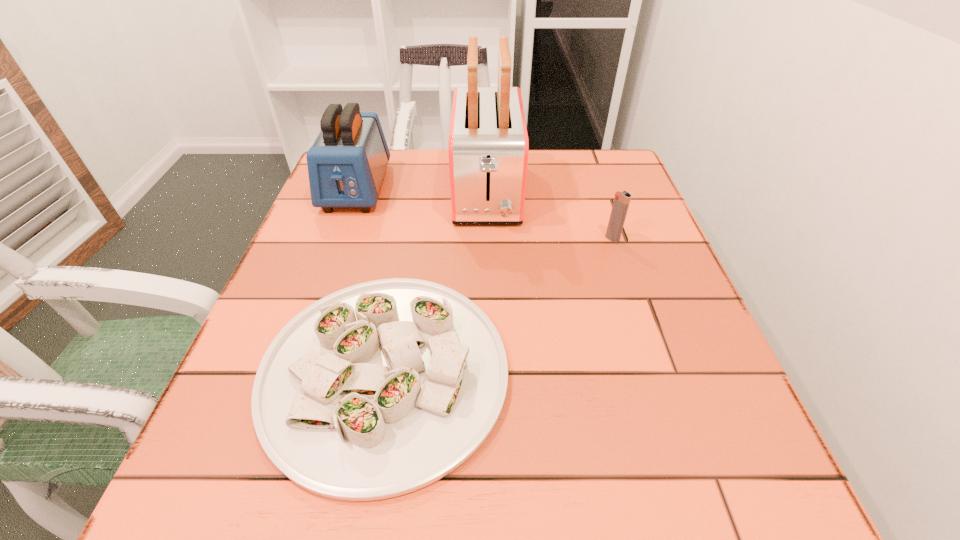
This screenshot has height=540, width=960. In order to click on vacant region between the shortest object and the igniter in this screenshot , I will do `click(498, 305)`.

Locate an element on the screen. Image resolution: width=960 pixels, height=540 pixels. free point between the platter and the rightmost object is located at coordinates 498,305.

The width and height of the screenshot is (960, 540). I want to click on vacant space that is in between the shortest object and the third shortest object, so click(x=371, y=280).

Where is `object that stands as the third closest to the shorter toaster`? object that stands as the third closest to the shorter toaster is located at coordinates (622, 200).

The width and height of the screenshot is (960, 540). What are the coordinates of `object that is the third nearest to the shorter toaster` in the screenshot? It's located at (622, 200).

Locate an element on the screen. vacant region that satisfies the following two spatial constraints: 1. on the front-facing side of the third shortest object; 2. on the right side of the nearest object is located at coordinates (289, 372).

Image resolution: width=960 pixels, height=540 pixels. What are the coordinates of `vacant space that satisfies the following two spatial constraints: 1. on the front-facing side of the platter; 2. on the right side of the left toaster` in the screenshot? It's located at (289, 372).

I want to click on vacant space that satisfies the following two spatial constraints: 1. on the front-facing side of the rightmost object; 2. on the right side of the third shortest object, so click(338, 239).

This screenshot has width=960, height=540. I want to click on free space that satisfies the following two spatial constraints: 1. on the front-facing side of the igniter; 2. on the left side of the third shortest object, so click(x=338, y=239).

Image resolution: width=960 pixels, height=540 pixels. What are the coordinates of `free point that satisfies the following two spatial constraints: 1. on the front-facing side of the rightmost object; 2. on the right side of the left toaster` in the screenshot? It's located at (338, 239).